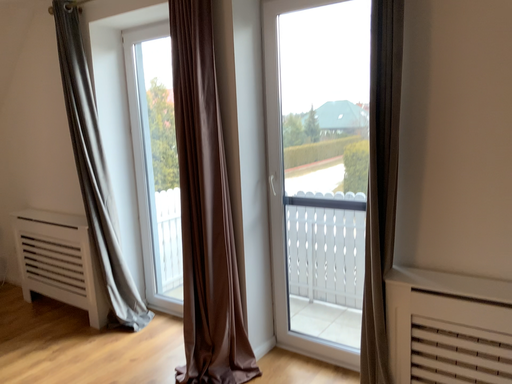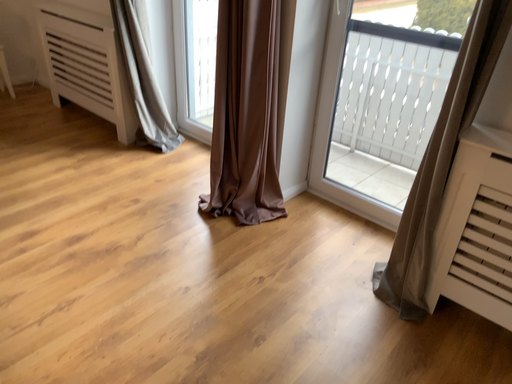
Question: How did the camera likely rotate when shooting the video?

Choices:
 (A) rotated right
 (B) rotated left

Answer: (B)